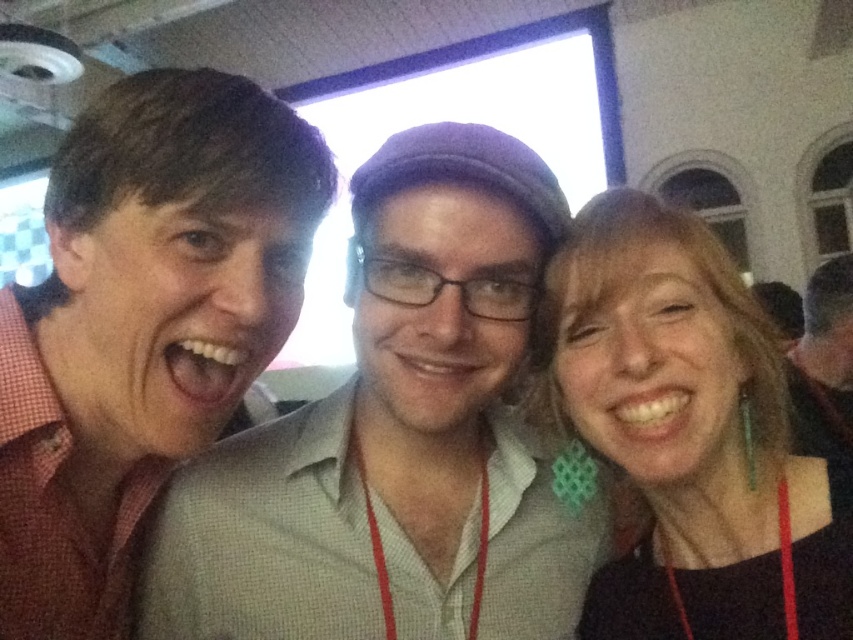
Question: Is matte red shirt at center further to camera compared to black fabric earrings at right?

Choices:
 (A) yes
 (B) no

Answer: (A)

Question: Does matte red shirt at center appear on the left side of pink checkered shirt at left?

Choices:
 (A) yes
 (B) no

Answer: (B)

Question: Can you confirm if pink checkered shirt at left is thinner than black fabric earrings at right?

Choices:
 (A) no
 (B) yes

Answer: (A)

Question: Which object appears closest to the camera in this image?

Choices:
 (A) pink checkered shirt at left
 (B) black fabric earrings at right
 (C) matte red shirt at center

Answer: (B)

Question: Which object is farther from the camera taking this photo?

Choices:
 (A) pink checkered shirt at left
 (B) black fabric earrings at right
 (C) matte red shirt at center

Answer: (C)

Question: Estimate the real-world distances between objects in this image. Which object is closer to the black fabric earrings at right?

Choices:
 (A) matte red shirt at center
 (B) pink checkered shirt at left

Answer: (A)